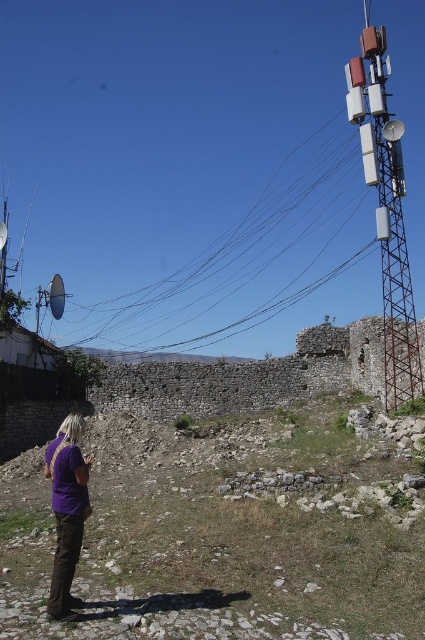
You are a photographer trying to position a 10cm long black wire at upper right in the image. Where exactly should you place it?

You should place the black wire at upper right at point coordinates of (226,268).

Consider the image. You are a photographer trying to capture a detailed shot of the black wire at upper right and the purple cotton shirt at lower left. Since you want both objects to appear equally prominent in the photo, which object should you zoom in on more?

The black wire at upper right is larger in size than the purple cotton shirt at lower left, so you should zoom in more on the purple cotton shirt at lower left to balance their prominence in the photo.

You are a photographer who wants to capture a closeup of the black wire at upper right and the purple cotton shirt at lower left. Which object should you zoom in on first to ensure it fits in the frame?

The black wire at upper right might be wider than the purple cotton shirt at lower left, so you should zoom in on the black wire at upper right first to ensure it fits in the frame.